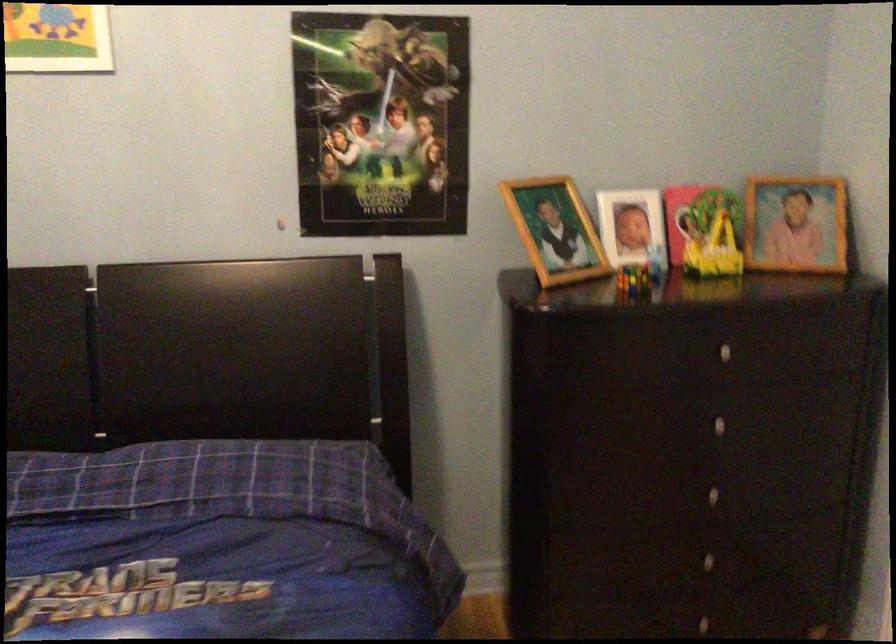
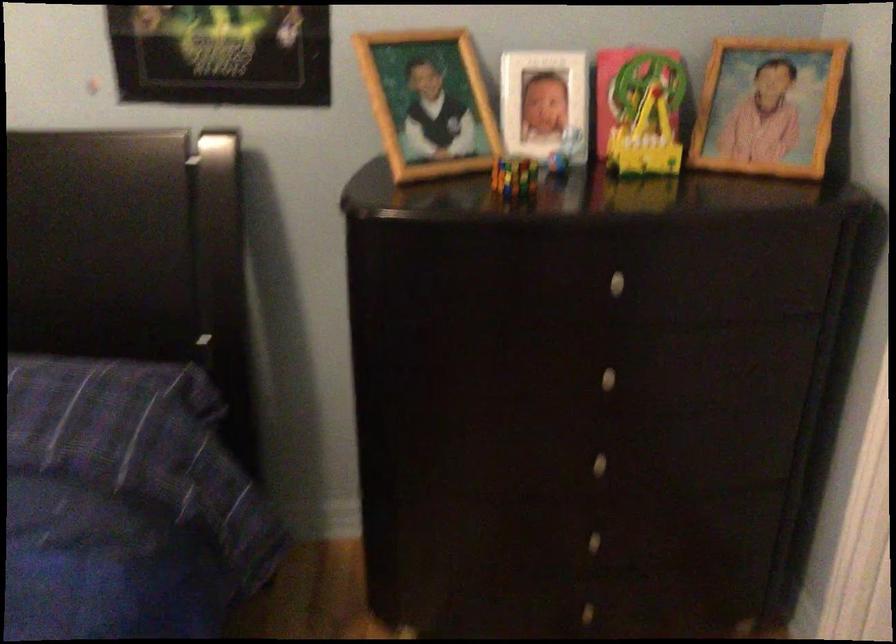
What movement of the cameraman would produce the second image?

The cameraman moved toward right, forward.